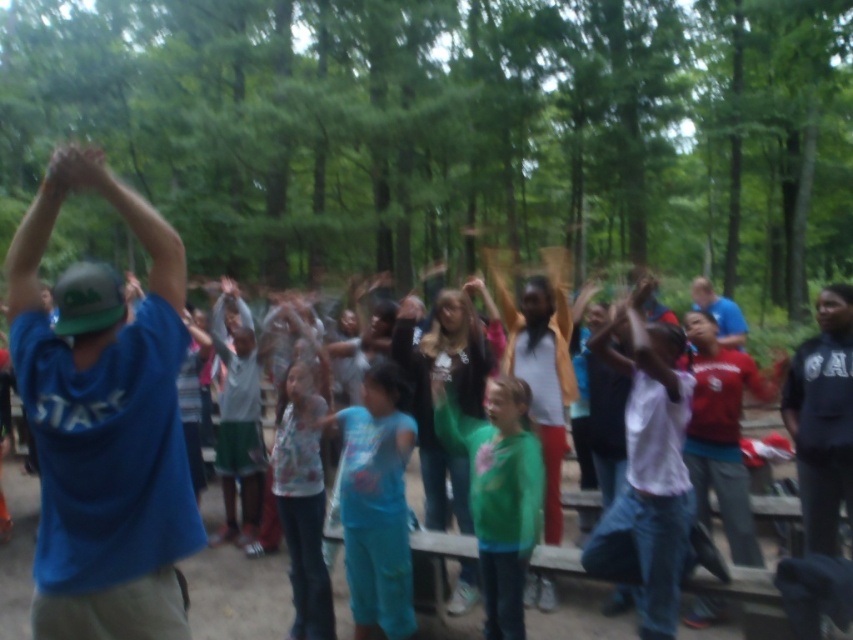
Question: Does blue cotton shirt at center appear under printed cotton shirt at center?

Choices:
 (A) yes
 (B) no

Answer: (B)

Question: Based on their relative distances, which object is nearer to the green matte hoodie at center?

Choices:
 (A) white matte shirt at center
 (B) printed cotton shirt at center

Answer: (A)

Question: Is white matte shirt at center above printed cotton shirt at center?

Choices:
 (A) no
 (B) yes

Answer: (B)

Question: Is white matte shirt at center thinner than blue cotton shirt at center?

Choices:
 (A) yes
 (B) no

Answer: (A)

Question: Which of these objects is positioned closest to the green matte hoodie at center?

Choices:
 (A) printed cotton shirt at center
 (B) white matte shirt at center

Answer: (B)

Question: Which point is farther to the camera?

Choices:
 (A) green matte hoodie at center
 (B) blue cotton shirt at center
 (C) printed cotton shirt at center
 (D) white matte shirt at center

Answer: (C)